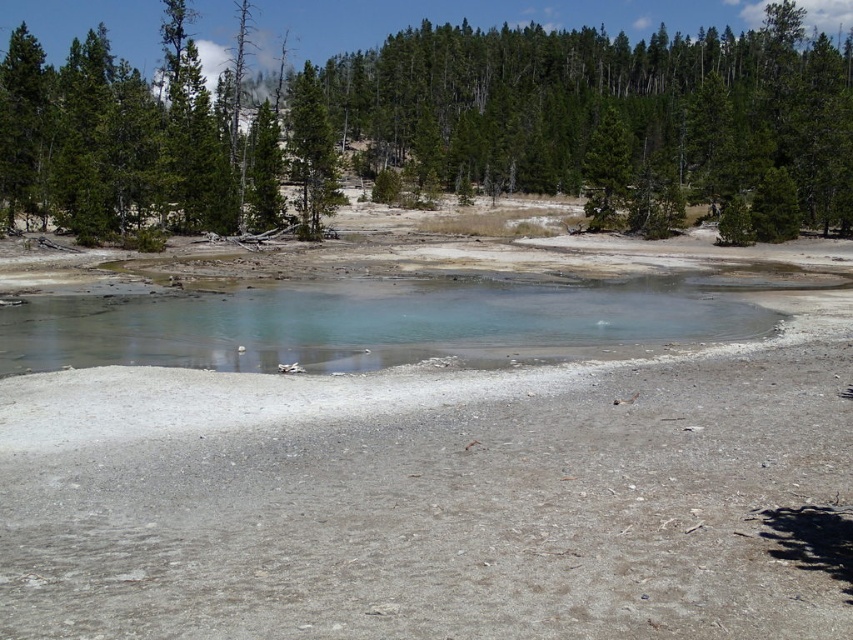
Question: Which of the following is the farthest from the observer?

Choices:
 (A) green textured pine tree at upper center
 (B) clear glass water at center
 (C) green leafy tree at upper center

Answer: (A)

Question: Which object is farther from the camera taking this photo?

Choices:
 (A) green textured pine tree at upper center
 (B) green leafy tree at upper center
 (C) clear glass water at center

Answer: (A)

Question: Estimate the real-world distances between objects in this image. Which object is farther from the green textured pine tree at upper center?

Choices:
 (A) green leafy tree at upper center
 (B) clear glass water at center

Answer: (A)

Question: From the image, what is the correct spatial relationship of green leafy tree at upper center in relation to green textured pine tree at upper center?

Choices:
 (A) right
 (B) left

Answer: (A)

Question: Can you confirm if green leafy tree at upper center is positioned to the right of clear glass water at center?

Choices:
 (A) yes
 (B) no

Answer: (B)

Question: Does clear glass water at center have a larger size compared to green textured pine tree at upper center?

Choices:
 (A) yes
 (B) no

Answer: (B)